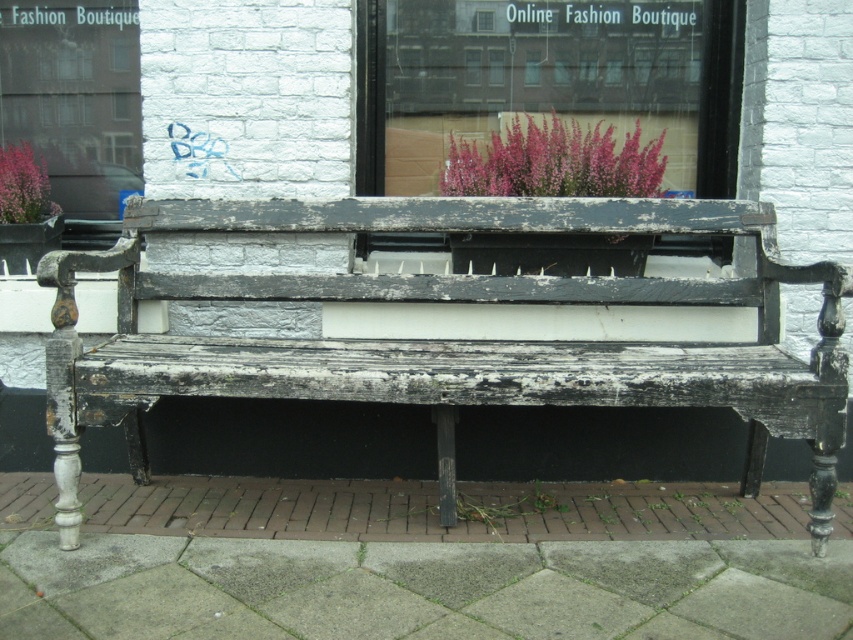
Is distressed wood bench at center thinner than pink fluffy plant at upper center?

In fact, distressed wood bench at center might be wider than pink fluffy plant at upper center.

Which is behind, point (689, 387) or point (619, 161)?

The point (619, 161) is more distant.

This screenshot has width=853, height=640. Find the location of `distressed wood bench at center`. distressed wood bench at center is located at coordinates (x=444, y=339).

Does point (722, 611) lie behind point (15, 164)?

No, (722, 611) is closer to viewer.

Who is positioned more to the left, concrete paving at lower center or matte pink flowers at upper left?

Positioned to the left is matte pink flowers at upper left.

Does point (425, 573) come behind point (47, 202)?

No, (425, 573) is in front of (47, 202).

This screenshot has width=853, height=640. In order to click on concrete paving at lower center in this screenshot , I will do `click(419, 561)`.

Who is more distant from viewer, (294,522) or (544,161)?

Point (544,161)

Which is more to the left, concrete paving at lower center or pink fluffy plant at upper center?

Positioned to the left is concrete paving at lower center.

Locate an element on the screen. The width and height of the screenshot is (853, 640). concrete paving at lower center is located at coordinates (419, 561).

At what (x,y) coordinates should I click in order to perform the action: click on concrete paving at lower center. Please return your answer as a coordinate pair (x, y). Looking at the image, I should click on (x=419, y=561).